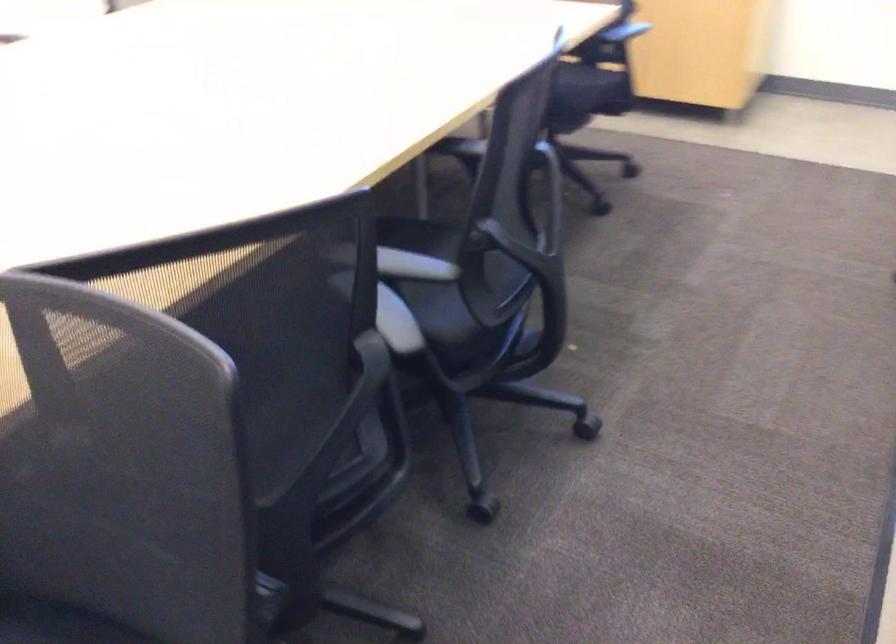
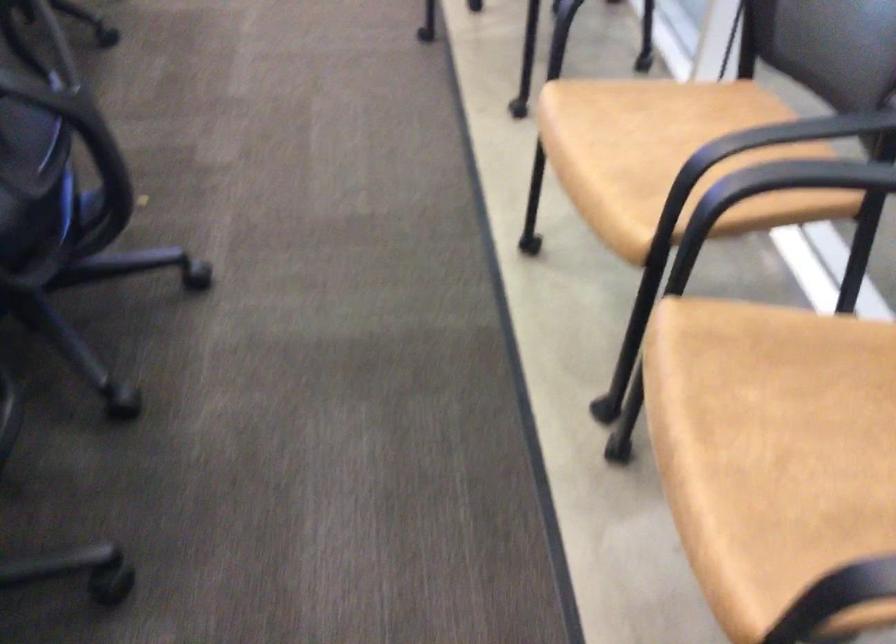
Question: The camera is either moving clockwise (left) or counter-clockwise (right) around the object. The first image is from the beginning of the video and the second image is from the end. Is the camera moving left or right when shooting the video?

Choices:
 (A) Left
 (B) Right

Answer: (A)